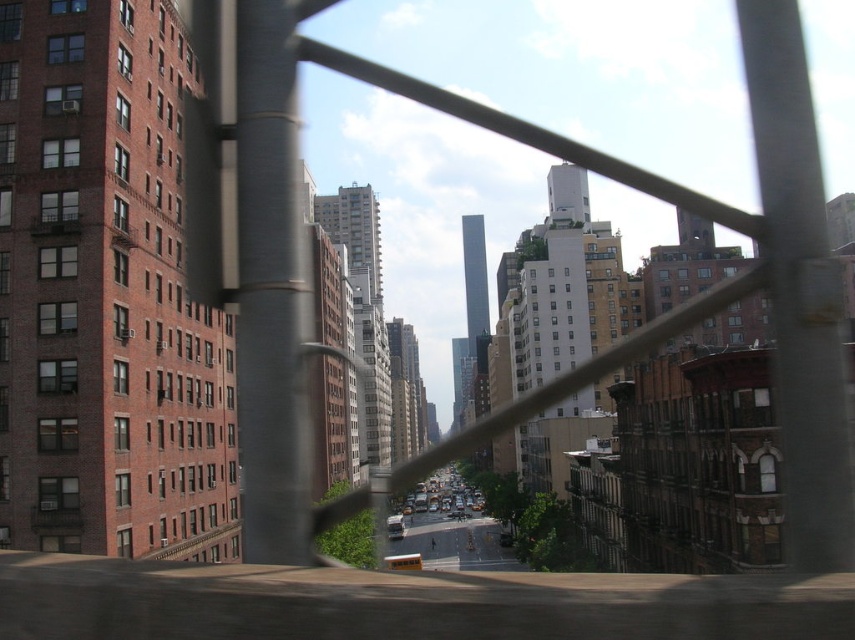
You are standing on an elevated walkway looking down at the city through a metal railing. You notice two points marked on the ground below. The first point is at coordinates point (793,401) and the second is at point (252,550). Which point is closer to you?

Point (793,401) is closer to the viewer than point (252,550).

You are standing at the edge of a bridge and notice two poles ahead of you. One is the metallic gray pole at right and the other is the smooth metallic pole at center. Which pole would you reach first if you walk straight ahead?

You would reach the metallic gray pole at right first because it is closer to you than the smooth metallic pole at center.